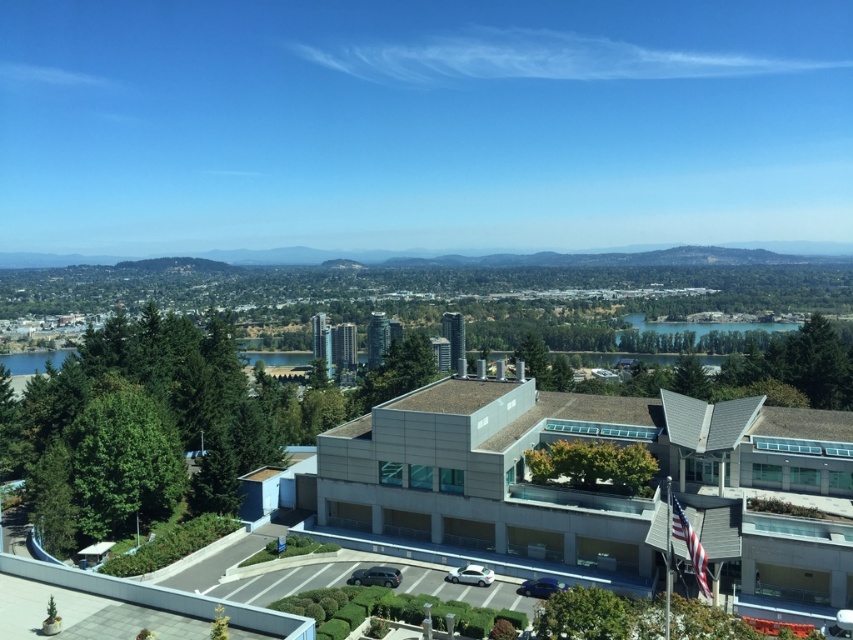
Question: Which point is farther to the camera?

Choices:
 (A) satin silver sedan at center
 (B) glossy blue car at lower center

Answer: (A)

Question: Which object appears farthest from the camera in this image?

Choices:
 (A) blue glassy lake at center
 (B) glossy blue car at lower center
 (C) shiny black suv at center
 (D) satin silver sedan at center

Answer: (A)

Question: Does blue glassy lake at center have a smaller size compared to shiny black suv at center?

Choices:
 (A) yes
 (B) no

Answer: (B)

Question: From the image, what is the correct spatial relationship of blue glassy lake at center in relation to satin silver sedan at center?

Choices:
 (A) above
 (B) below

Answer: (A)

Question: Among these points, which one is nearest to the camera?

Choices:
 (A) (396, 580)
 (B) (465, 568)

Answer: (A)

Question: Can you confirm if blue glassy lake at center is positioned below satin silver sedan at center?

Choices:
 (A) no
 (B) yes

Answer: (A)